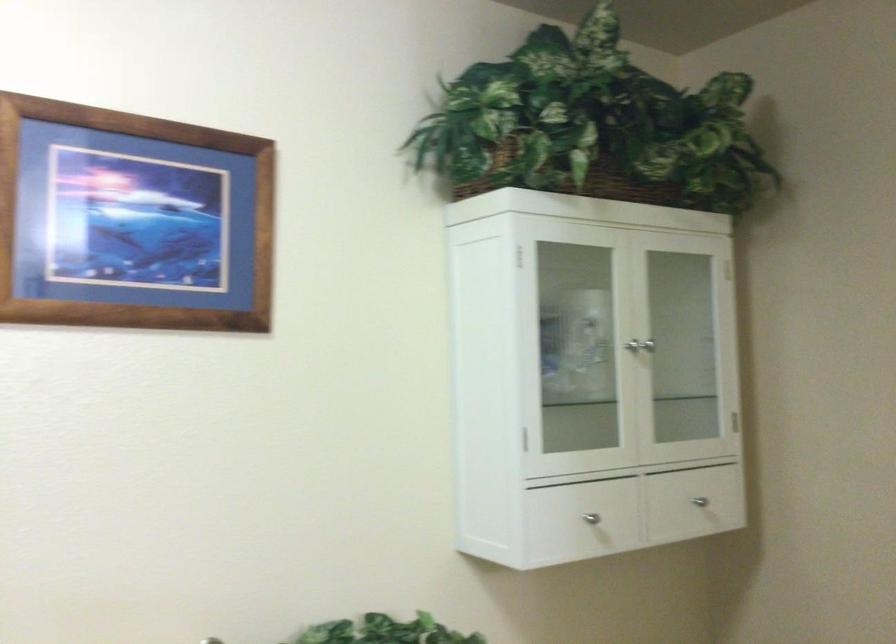
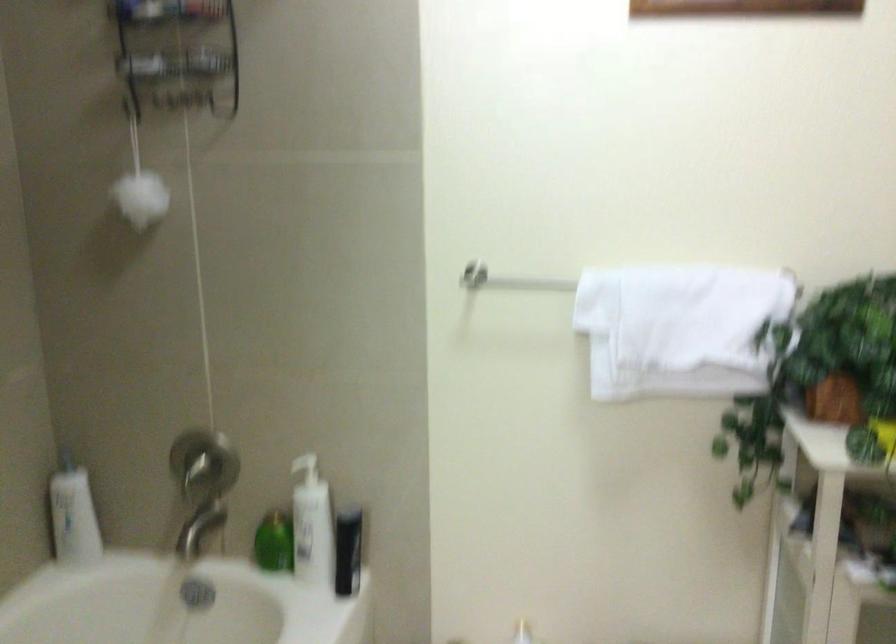
The images are taken continuously from a first-person perspective. In which direction is your viewpoint rotating?

The camera rotated toward left-down.